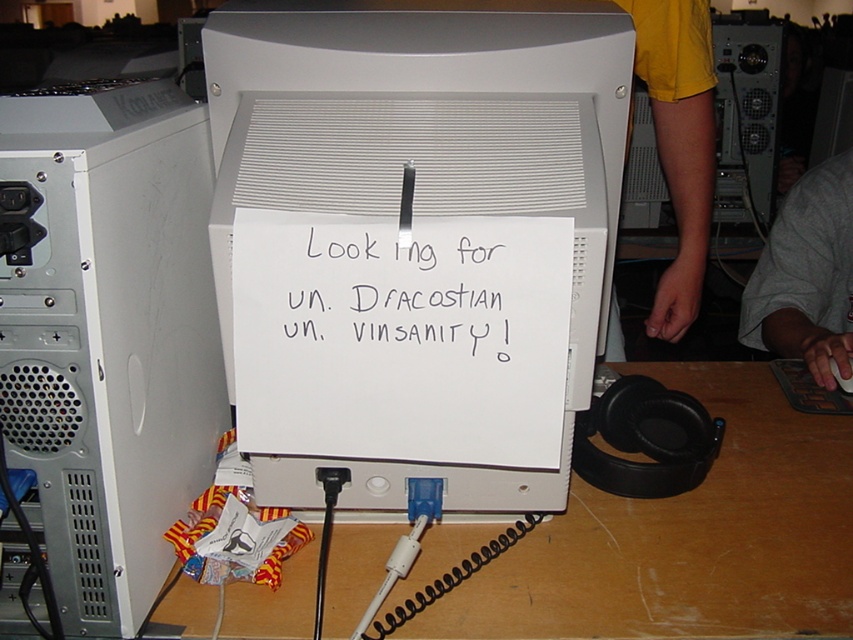
You are a technician inspecting the computer setup. You notice two points marked on the image at coordinates point (50, 128) and point (215, 220). Which point is nearer to your current viewpoint?

Point (50, 128) is closer to the camera than point (215, 220).

You are a technician trying to fix the computer tower. You need to locate the silver metallic desktop computer at left. Where is it located in the coordinate system of the image?

The silver metallic desktop computer at left is located at point coordinates of (107, 332).

You are setting up a new computer desk and need to place the silver metallic desktop computer at left and the white plastic monitor at center. Based on their sizes, which object should be placed first to ensure proper desk arrangement?

The silver metallic desktop computer at left should be placed first since it has a smaller size compared to the white plastic monitor at center, allowing for easier positioning without obstructing larger items.